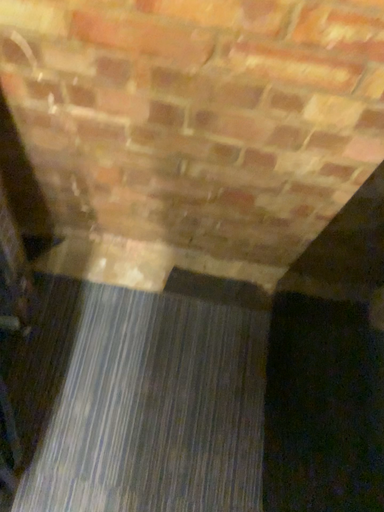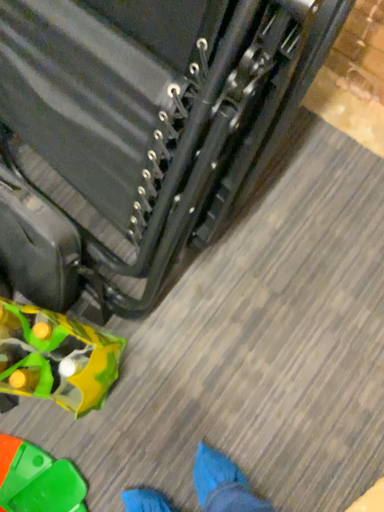
Question: How did the camera likely rotate when shooting the video?

Choices:
 (A) rotated right
 (B) rotated left

Answer: (B)